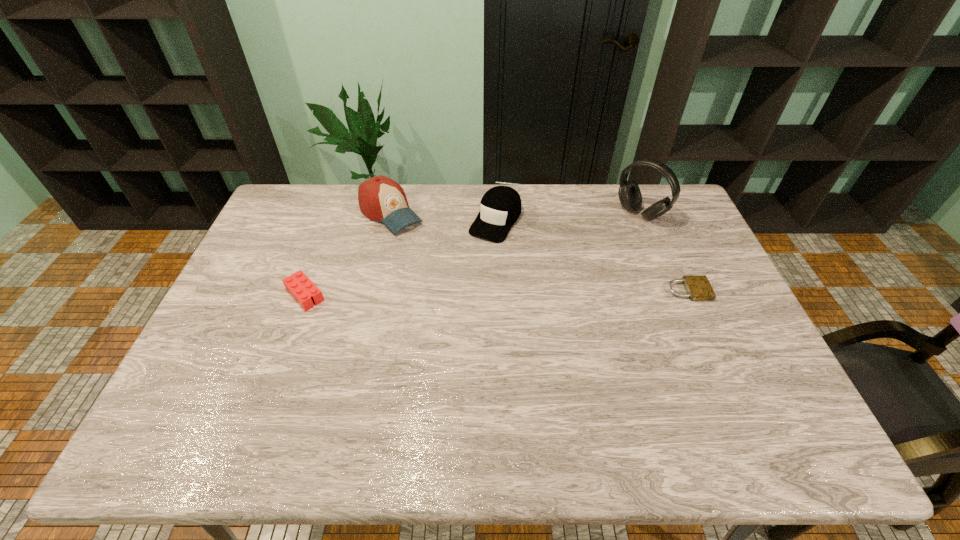
Find the location of a particular element. free space that satisfies the following two spatial constraints: 1. on the back side of the fourth object from right to left; 2. on the left side of the leftmost object is located at coordinates (335, 213).

The height and width of the screenshot is (540, 960). In order to click on blank space that satisfies the following two spatial constraints: 1. on the back side of the cap; 2. on the right side of the tallest object in this screenshot , I will do `click(495, 214)`.

This screenshot has width=960, height=540. Find the location of `vacant region that satisfies the following two spatial constraints: 1. on the front side of the shortest object; 2. on the keyhole side of the tallest object`. vacant region that satisfies the following two spatial constraints: 1. on the front side of the shortest object; 2. on the keyhole side of the tallest object is located at coordinates (671, 291).

Locate an element on the screen. free region that satisfies the following two spatial constraints: 1. on the back side of the fourth tallest object; 2. on the keyhole side of the padlock is located at coordinates (306, 291).

Find the location of `free location that satisfies the following two spatial constraints: 1. on the front side of the cap; 2. on the keyhole side of the padlock`. free location that satisfies the following two spatial constraints: 1. on the front side of the cap; 2. on the keyhole side of the padlock is located at coordinates (498, 291).

Identify the location of blank area in the image that satisfies the following two spatial constraints: 1. on the back side of the shortest object; 2. on the keyhole side of the leftmost object. This screenshot has height=540, width=960. (306, 291).

The height and width of the screenshot is (540, 960). I want to click on free point that satisfies the following two spatial constraints: 1. on the back side of the padlock; 2. on the keyhole side of the leftmost object, so click(x=306, y=291).